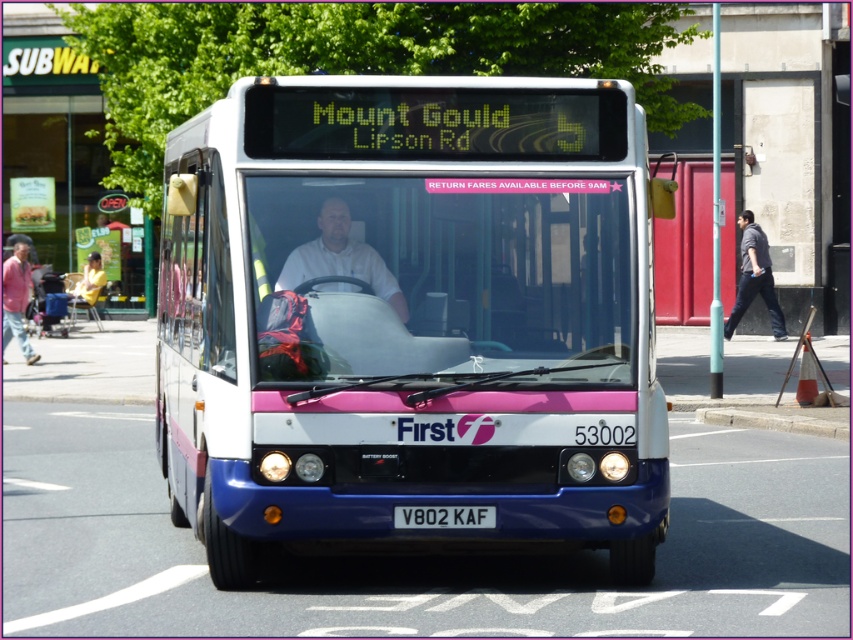
You are a passenger on the bus and looking out the window. You see a dark gray shirt at right and a gray concrete curb at lower center. Which object appears taller in the window view?

The dark gray shirt at right appears much taller than the gray concrete curb at lower center.

You are a pedestrian standing on the gray concrete curb at lower center and want to cross the road to the dark gray shirt at right. The bus is moving towards you. Can you safely cross before the bus arrives?

The dark gray shirt at right and gray concrete curb at lower center are 8.03 meters apart. Since the bus is moving, it is unsafe to cross as the distance is too short to guarantee safety before the bus arrives.

You are a passenger on the bus and notice two items in your line of sight. One is a matte pink jacket at left and the other is a white rectangular license plate at center. Which one is positioned higher relative to the other?

The matte pink jacket at left is positioned above the white rectangular license plate at center, so it is higher.